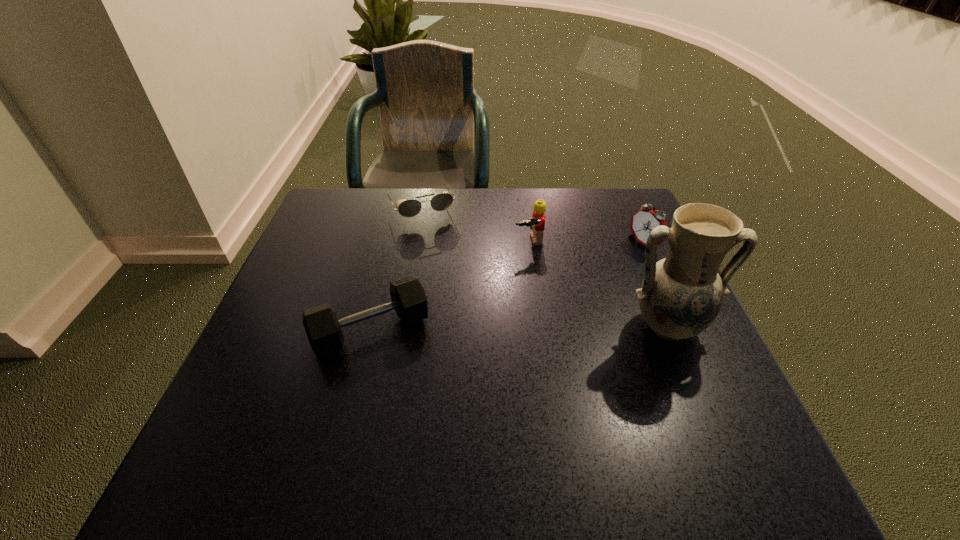
Image resolution: width=960 pixels, height=540 pixels. Identify the location of vacant area situated on the clock face of the alarm clock. (516, 314).

The height and width of the screenshot is (540, 960). I want to click on free region located 0.330m on the front lenses of the shortest object, so click(x=473, y=309).

I want to click on free space located 0.130m on the front lenses of the shortest object, so click(x=445, y=254).

Where is `free space located on the front lenses of the shortest object`? free space located on the front lenses of the shortest object is located at coordinates (460, 282).

Find the location of a particular element. The width and height of the screenshot is (960, 540). vacant space located in front of the third object from left to right with the accessory visible is located at coordinates (560, 321).

Identify the location of vacant space located in front of the third object from left to right with the accessory visible. The height and width of the screenshot is (540, 960). (547, 289).

Image resolution: width=960 pixels, height=540 pixels. In order to click on vacant region located 0.220m in front of the third object from left to right with the accessory visible in this screenshot , I will do `click(557, 315)`.

This screenshot has height=540, width=960. What are the coordinates of `alarm clock that is at the far edge` in the screenshot? It's located at (646, 219).

This screenshot has width=960, height=540. In order to click on sunglasses positioned at the far edge in this screenshot , I will do pyautogui.click(x=409, y=208).

The width and height of the screenshot is (960, 540). In order to click on Lego that is positioned at the far edge in this screenshot , I will do `click(537, 223)`.